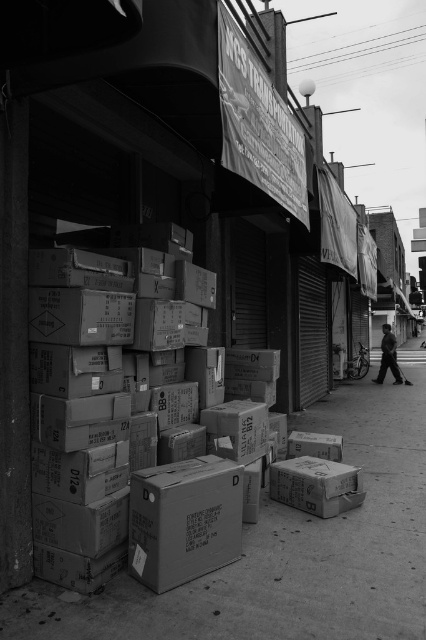
Measure the distance between matte cardboard boxes at lower center and camera.

A distance of 3.19 meters exists between matte cardboard boxes at lower center and camera.

Between point (75, 611) and point (389, 348), which one is positioned behind?

Point (389, 348)

You are a GUI agent. You are given a task and a screenshot of the screen. Output one action in this format:
    pyautogui.click(x=<x>, y=<y>)
    Task: Click on the matte cardboard boxes at lower center
    
    Given the screenshot: What is the action you would take?
    pyautogui.click(x=288, y=550)